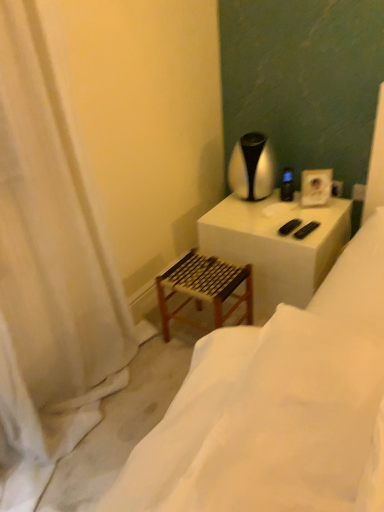
Question: Does black plastic remote control at upper right have a lesser height compared to white fabric curtain at left?

Choices:
 (A) yes
 (B) no

Answer: (A)

Question: Is black plastic remote control at upper right facing away from white fabric curtain at left?

Choices:
 (A) yes
 (B) no

Answer: (B)

Question: From the image's perspective, is black plastic remote control at upper right over white fabric curtain at left?

Choices:
 (A) yes
 (B) no

Answer: (A)

Question: Is there a large distance between black plastic remote control at upper right and white fabric curtain at left?

Choices:
 (A) no
 (B) yes

Answer: (B)

Question: Can you confirm if black plastic remote control at upper right is bigger than white fabric curtain at left?

Choices:
 (A) no
 (B) yes

Answer: (A)

Question: Considering the relative sizes of black plastic remote control at upper right and white fabric curtain at left in the image provided, is black plastic remote control at upper right wider than white fabric curtain at left?

Choices:
 (A) yes
 (B) no

Answer: (B)

Question: From a real-world perspective, is black plastic remote control at upper right physically above wooden stool at lower left?

Choices:
 (A) no
 (B) yes

Answer: (A)

Question: Could you tell me if black plastic remote control at upper right is turned towards wooden stool at lower left?

Choices:
 (A) no
 (B) yes

Answer: (B)

Question: Is wooden stool at lower left at the back of black plastic remote control at upper right?

Choices:
 (A) no
 (B) yes

Answer: (A)

Question: Is black plastic remote control at upper right not inside wooden stool at lower left?

Choices:
 (A) no
 (B) yes

Answer: (B)

Question: Is black plastic remote control at upper right bigger than wooden stool at lower left?

Choices:
 (A) yes
 (B) no

Answer: (B)

Question: Are black plastic remote control at upper right and wooden stool at lower left located far from each other?

Choices:
 (A) yes
 (B) no

Answer: (A)

Question: Is silver metallic table lamp at upper right completely or partially outside of wooden stool at lower left?

Choices:
 (A) yes
 (B) no

Answer: (A)